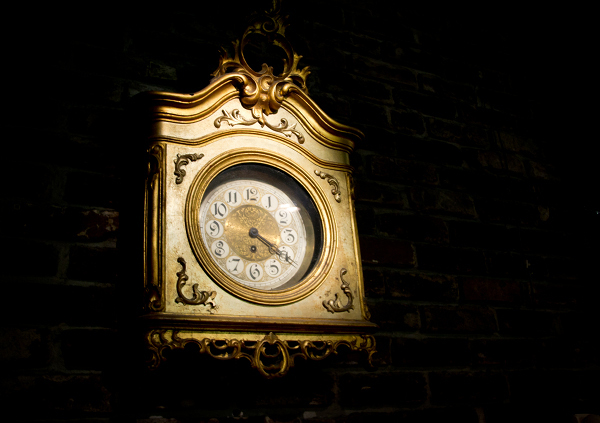
Where is `ornate molding surrounding clock face`? ornate molding surrounding clock face is located at coordinates [x=184, y=302], [x=341, y=304], [x=338, y=182], [x=178, y=168], [x=258, y=121].